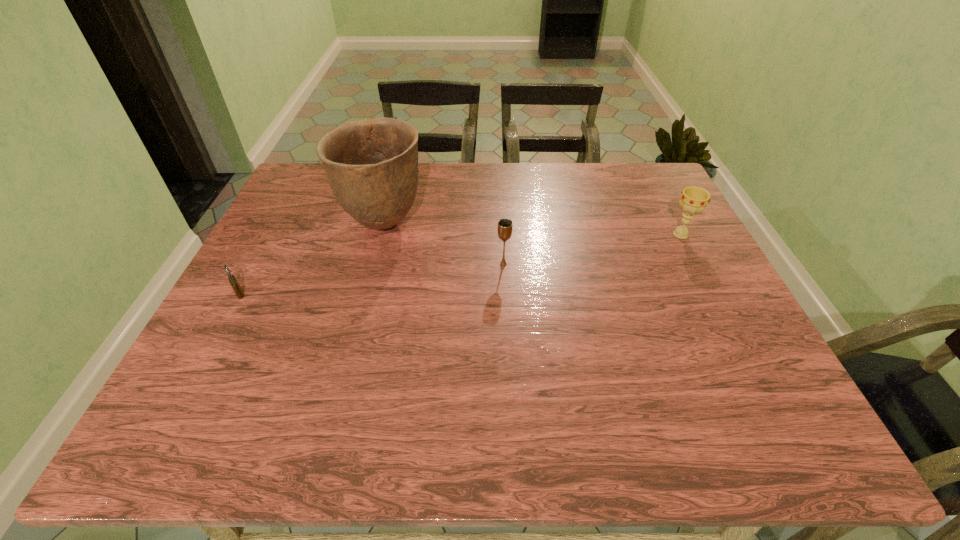
Locate an element on the screen. The width and height of the screenshot is (960, 540). free space located 0.310m on the right of the second nearest object is located at coordinates (x=631, y=264).

I want to click on free space located 0.190m on the back of the nearest object, so pos(270,238).

Where is `object located in the far edge section of the desktop`? object located in the far edge section of the desktop is located at coordinates (372, 165).

Where is `object that is positioned at the left edge`? The height and width of the screenshot is (540, 960). object that is positioned at the left edge is located at coordinates (233, 281).

The image size is (960, 540). Identify the location of object situated at the right edge. (694, 199).

In the image, there is a desktop. Identify the location of vacant space at the far edge. The height and width of the screenshot is (540, 960). (472, 170).

Where is `vacant space at the near edge of the desktop`? Image resolution: width=960 pixels, height=540 pixels. vacant space at the near edge of the desktop is located at coordinates (591, 447).

At what (x,y) coordinates should I click in order to perform the action: click on free space at the left edge of the desktop. Please return your answer as a coordinate pair (x, y). The width and height of the screenshot is (960, 540). Looking at the image, I should click on (265, 246).

In the image, there is a desktop. At what (x,y) coordinates should I click in order to perform the action: click on vacant area at the right edge. Please return your answer as a coordinate pair (x, y). The image size is (960, 540). Looking at the image, I should click on (659, 241).

The height and width of the screenshot is (540, 960). In order to click on free space at the far right corner in this screenshot , I will do `click(652, 182)`.